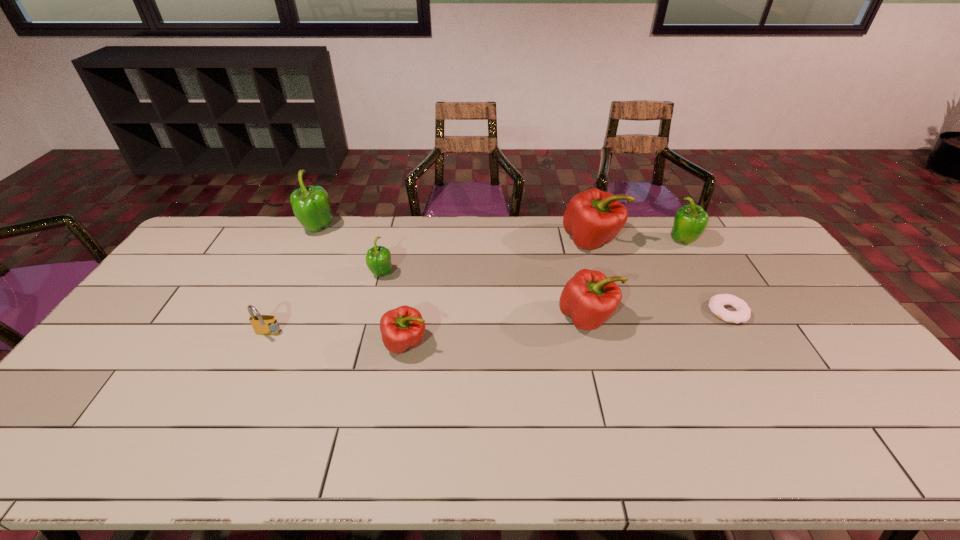
Point out which pink bell pepper is positioned as the nearest to the leftmost pink bell pepper. Please provide its 2D coordinates. Your answer should be formatted as a tuple, i.e. [(x, y)], where the tuple contains the x and y coordinates of a point satisfying the conditions above.

[(589, 298)]

Find the location of a particular element. The height and width of the screenshot is (540, 960). free space that satisfies the following two spatial constraints: 1. on the back side of the doughnut; 2. on the left side of the second smallest pink bell pepper is located at coordinates (586, 312).

I want to click on vacant region that satisfies the following two spatial constraints: 1. on the front side of the farthest pink bell pepper; 2. on the right side of the biggest green bell pepper, so click(x=313, y=241).

The image size is (960, 540). Find the location of `free point that satisfies the following two spatial constraints: 1. on the back side of the second green bell pepper from right to left; 2. on the left side of the rightmost green bell pepper`. free point that satisfies the following two spatial constraints: 1. on the back side of the second green bell pepper from right to left; 2. on the left side of the rightmost green bell pepper is located at coordinates (390, 241).